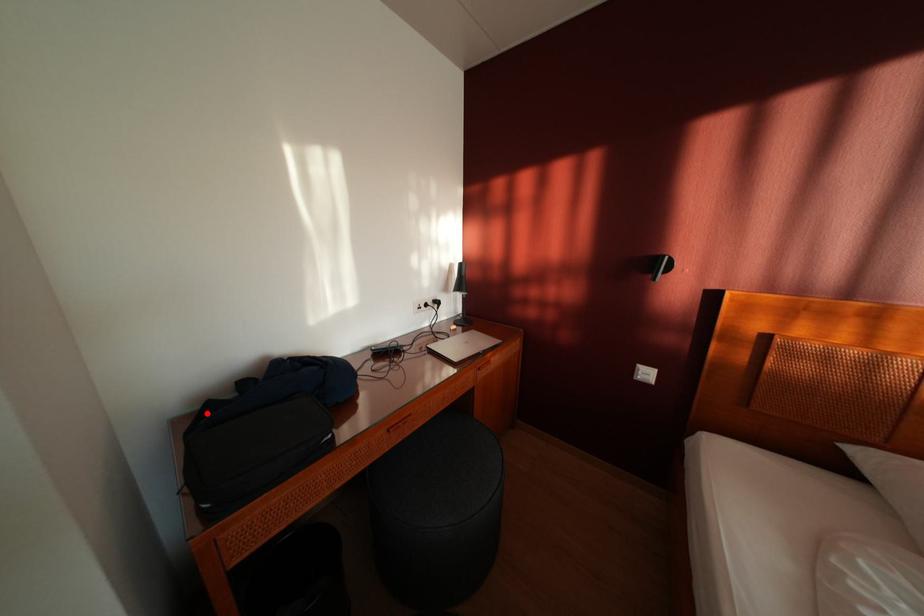
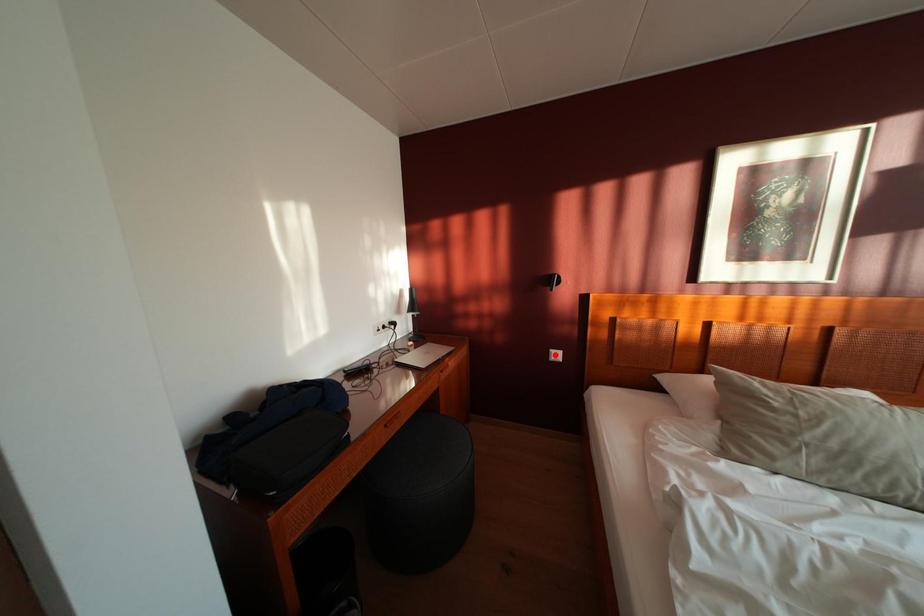
I am providing you with two images of the same scene from different viewpoints. A red point is marked on the first image and another point is marked on the second image. Does the point marked in image1 correspond to the same location as the one in image2?

No